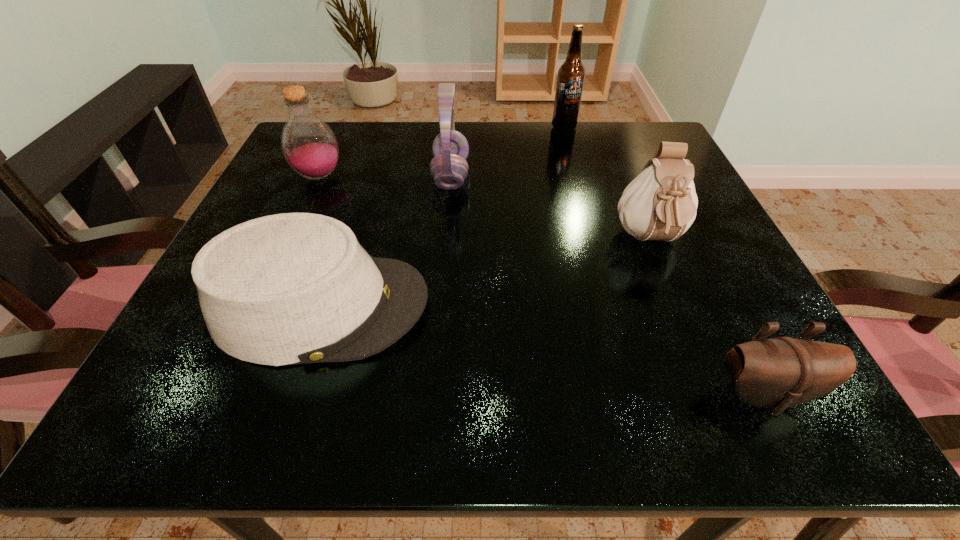
At what (x,y) coordinates should I click in order to perform the action: click on object at the near right corner. Please return your answer as a coordinate pair (x, y). The image size is (960, 540). Looking at the image, I should click on (779, 373).

What are the coordinates of `vacant space at the far edge of the desktop` in the screenshot? It's located at (381, 137).

Locate an element on the screen. This screenshot has height=540, width=960. blank space at the near edge is located at coordinates (376, 375).

In order to click on vacant space at the right edge in this screenshot , I will do `click(739, 285)`.

You are a GUI agent. You are given a task and a screenshot of the screen. Output one action in this format:
    pyautogui.click(x=<x>, y=<y>)
    Task: Click on the free space at the far right corner of the desktop
    The image size is (960, 540).
    Given the screenshot: What is the action you would take?
    pyautogui.click(x=621, y=133)

Where is `free location at the near right corner of the desktop`? This screenshot has width=960, height=540. free location at the near right corner of the desktop is located at coordinates (697, 395).

This screenshot has height=540, width=960. I want to click on free space between the nearer pouch and the taller pouch, so click(707, 318).

Locate an element on the screen. free point between the fourth object from left to right and the hat is located at coordinates (443, 217).

Where is `empty space between the hat and the shorter pouch`? Image resolution: width=960 pixels, height=540 pixels. empty space between the hat and the shorter pouch is located at coordinates point(541,350).

Identify the location of empty space between the hat and the headset. (386, 241).